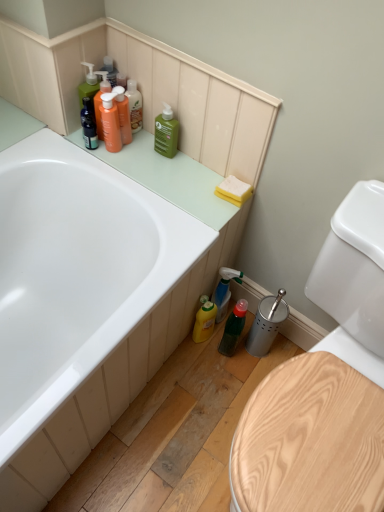
Where is `empty space that is in between translucent orange bottles at upper left, arranged as the 1th toiletry when ordered from the bottom, and green matte bottle at upper center, which appears as the 2th cleaning product when viewed from the top`? This screenshot has width=384, height=512. empty space that is in between translucent orange bottles at upper left, arranged as the 1th toiletry when ordered from the bottom, and green matte bottle at upper center, which appears as the 2th cleaning product when viewed from the top is located at coordinates (145, 149).